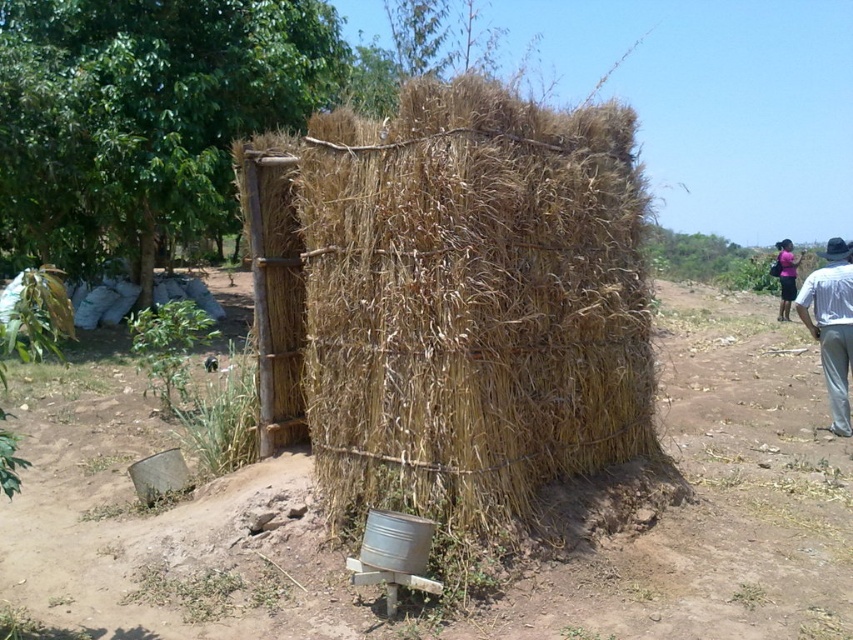
Is dry straw hut at center to the right of pink fabric dress at upper right from the viewer's perspective?

Incorrect, dry straw hut at center is not on the right side of pink fabric dress at upper right.

Between point (527, 218) and point (782, 301), which one is positioned behind?

Positioned behind is point (782, 301).

Where is `dry straw hut at center`? The height and width of the screenshot is (640, 853). dry straw hut at center is located at coordinates (451, 300).

Is dry straw hut at center above brown dirt field at center?

Yes, dry straw hut at center is above brown dirt field at center.

The height and width of the screenshot is (640, 853). I want to click on dry straw hut at center, so click(x=451, y=300).

Which is below, brown dirt field at center or white cotton shirt at right?

brown dirt field at center is below.

Is point (570, 563) more distant than point (817, 316)?

That is False.

Where is `brown dirt field at center`? brown dirt field at center is located at coordinates (523, 570).